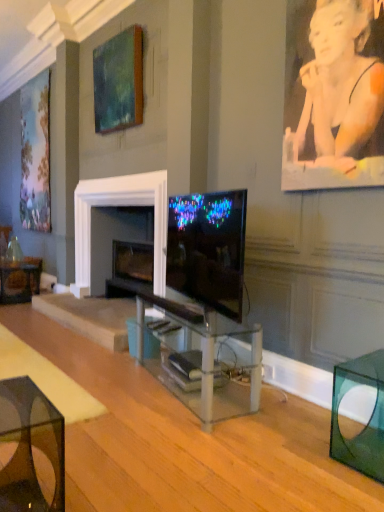
This screenshot has width=384, height=512. In order to click on vacant area that is in front of transparent glass table at center, positioned as the 3th table in front-to-back order in this screenshot , I will do `click(185, 450)`.